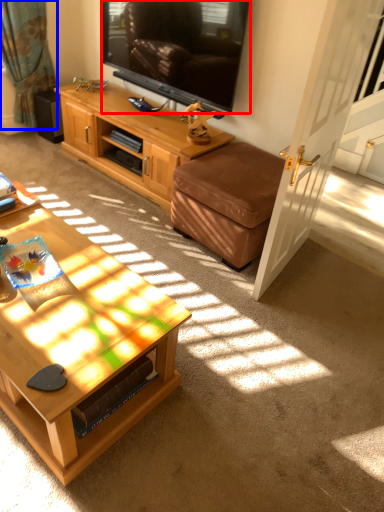
Question: Which object appears farthest to the camera in this image, television (highlighted by a red box) or curtain (highlighted by a blue box)?

Choices:
 (A) television
 (B) curtain

Answer: (B)